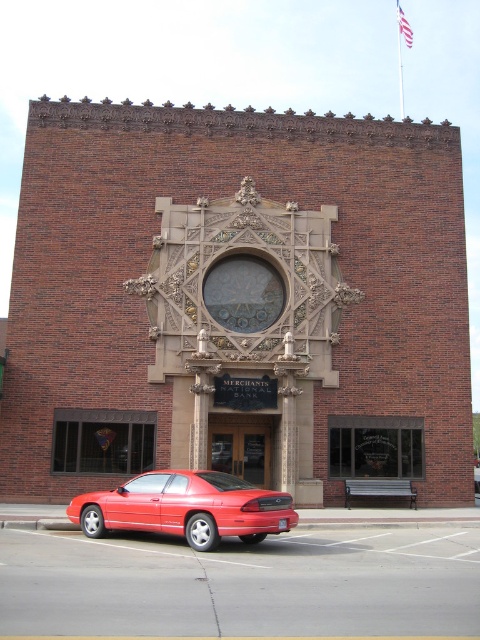
Does glossy red car at lower left come in front of metallic bench at lower center?

Yes, it is in front of metallic bench at lower center.

Is glossy red car at lower left thinner than metallic bench at lower center?

Incorrect, glossy red car at lower left's width is not less than metallic bench at lower center's.

Between point (250, 532) and point (408, 486), which one is positioned behind?

Positioned behind is point (408, 486).

This screenshot has height=640, width=480. In order to click on glossy red car at lower left in this screenshot , I will do `click(186, 508)`.